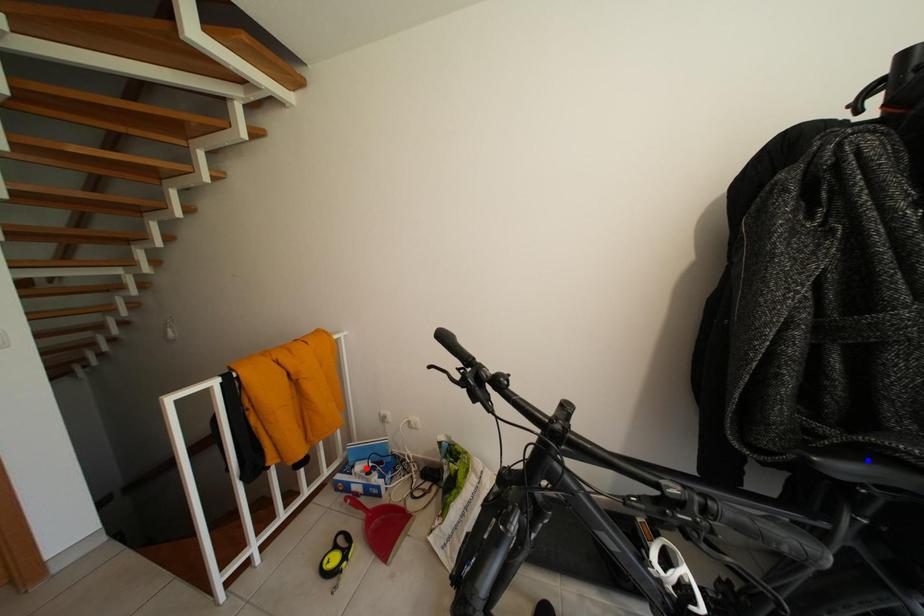
Question: Two points are marked on the image. Which point is closer to the camera?

Choices:
 (A) Blue point is closer.
 (B) Red point is closer.

Answer: (A)